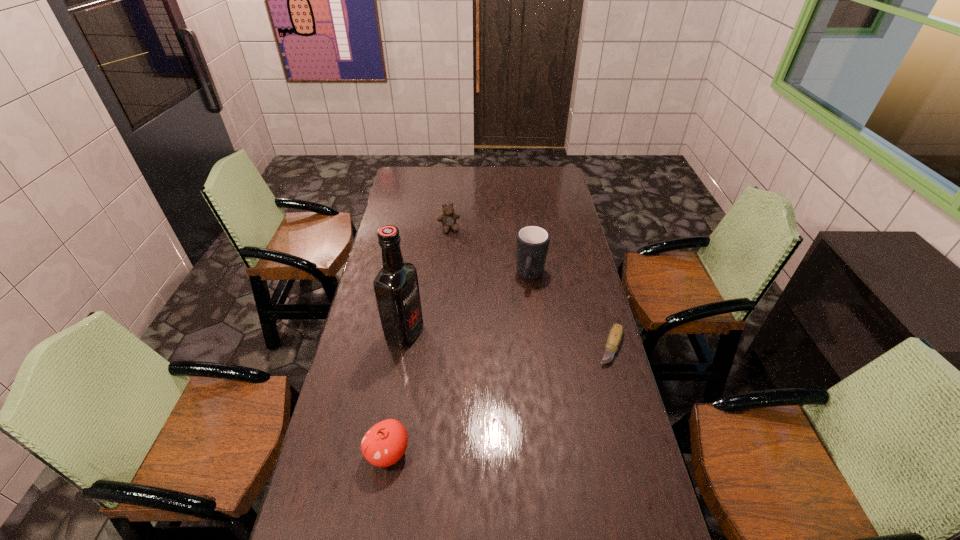
Where is `the nearest object`? the nearest object is located at coordinates (385, 443).

You are a GUI agent. You are given a task and a screenshot of the screen. Output one action in this format:
    pyautogui.click(x=<x>, y=<y>)
    Task: Click on the pocketknife
    
    Given the screenshot: What is the action you would take?
    pyautogui.click(x=614, y=338)

In order to click on the shortest object in this screenshot , I will do `click(614, 338)`.

Locate an element on the screen. the second tallest object is located at coordinates (532, 242).

The image size is (960, 540). What are the coordinates of `the second object from right to left` in the screenshot? It's located at (532, 242).

Where is `the farthest object`? This screenshot has width=960, height=540. the farthest object is located at coordinates (448, 219).

Where is `the third object from right to left`? The image size is (960, 540). the third object from right to left is located at coordinates (448, 219).

The height and width of the screenshot is (540, 960). In order to click on the tallest object in this screenshot , I will do `click(396, 287)`.

I want to click on free space located 0.110m on the front of the apple, so (x=377, y=519).

Where is `free space located 0.180m on the left of the rightmost object`? The height and width of the screenshot is (540, 960). free space located 0.180m on the left of the rightmost object is located at coordinates (542, 347).